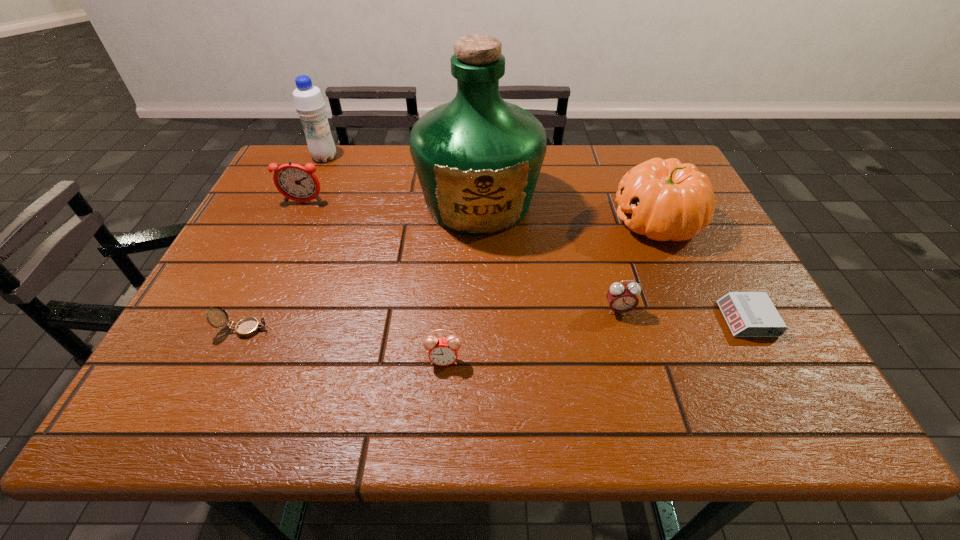
Where is `the shortest object`? The height and width of the screenshot is (540, 960). the shortest object is located at coordinates (748, 314).

Locate an element on the screen. This screenshot has height=540, width=960. the shortest alarm clock is located at coordinates (748, 314).

In order to click on vacant area situated on the label side of the liquor in this screenshot , I will do `click(478, 350)`.

In order to click on vacant space situated on the right of the seventh shortest object in this screenshot , I will do `click(358, 158)`.

The width and height of the screenshot is (960, 540). I want to click on free space located 0.330m on the carved face of the third tallest object, so click(x=478, y=221).

Find the location of a particular element. Image resolution: width=960 pixels, height=540 pixels. blank space located on the carved face of the third tallest object is located at coordinates (511, 221).

The image size is (960, 540). I want to click on free location located 0.140m on the carved face of the third tallest object, so click(x=555, y=221).

Where is `free space located on the front-facing side of the tallest alarm clock`? This screenshot has width=960, height=540. free space located on the front-facing side of the tallest alarm clock is located at coordinates (249, 321).

The height and width of the screenshot is (540, 960). Find the location of `vacant space situated on the clock face of the third object from right to left`. vacant space situated on the clock face of the third object from right to left is located at coordinates (640, 387).

Where is `vacant area situated on the clock face of the nearest object`? This screenshot has height=540, width=960. vacant area situated on the clock face of the nearest object is located at coordinates (442, 397).